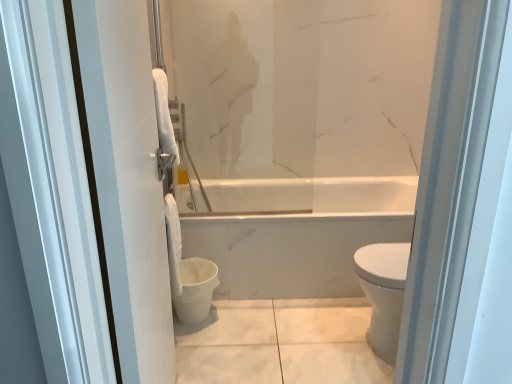
Question: From the image's perspective, is white fabric towel at lower center beneath white glossy towel at left?

Choices:
 (A) no
 (B) yes

Answer: (B)

Question: Is the position of white fabric towel at lower center more distant than that of white glossy towel at left?

Choices:
 (A) yes
 (B) no

Answer: (A)

Question: Can you confirm if white fabric towel at lower center is thinner than white glossy towel at left?

Choices:
 (A) yes
 (B) no

Answer: (A)

Question: Is white fabric towel at lower center outside white glossy towel at left?

Choices:
 (A) yes
 (B) no

Answer: (A)

Question: Considering the relative sizes of white fabric towel at lower center and white glossy towel at left in the image provided, is white fabric towel at lower center shorter than white glossy towel at left?

Choices:
 (A) no
 (B) yes

Answer: (B)

Question: Is white matte toilet bowl at lower center taller or shorter than white glossy towel at left?

Choices:
 (A) tall
 (B) short

Answer: (B)

Question: Looking at their shapes, would you say white matte toilet bowl at lower center is wider or thinner than white glossy towel at left?

Choices:
 (A) wide
 (B) thin

Answer: (A)

Question: Is point (188, 317) closer or farther from the camera than point (126, 195)?

Choices:
 (A) closer
 (B) farther

Answer: (B)

Question: Is white matte toilet bowl at lower center to the left or to the right of white glossy towel at left in the image?

Choices:
 (A) left
 (B) right

Answer: (B)

Question: Considering their positions, is white glossy towel at left located in front of or behind white matte toilet bowl at lower center?

Choices:
 (A) front
 (B) behind

Answer: (A)

Question: From the image's perspective, is white glossy towel at left positioned above or below white matte toilet bowl at lower center?

Choices:
 (A) below
 (B) above

Answer: (B)

Question: From a real-world perspective, is white glossy towel at left positioned above or below white matte toilet bowl at lower center?

Choices:
 (A) below
 (B) above

Answer: (B)

Question: Is point (121, 296) closer or farther from the camera than point (192, 269)?

Choices:
 (A) farther
 (B) closer

Answer: (B)

Question: From a real-world perspective, is white fabric towel at lower center physically located above or below white glossy towel at left?

Choices:
 (A) above
 (B) below

Answer: (B)

Question: Would you say white fabric towel at lower center is to the left or to the right of white glossy towel at left in the picture?

Choices:
 (A) left
 (B) right

Answer: (A)